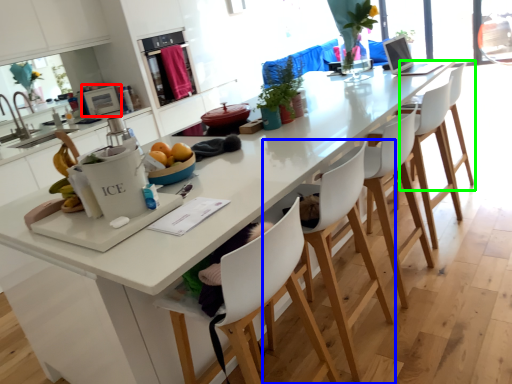
Question: Based on their relative distances, which object is farther from appliance (highlighted by a red box)? Choose from chair (highlighted by a blue box) and chair (highlighted by a green box).

Choices:
 (A) chair
 (B) chair

Answer: (A)